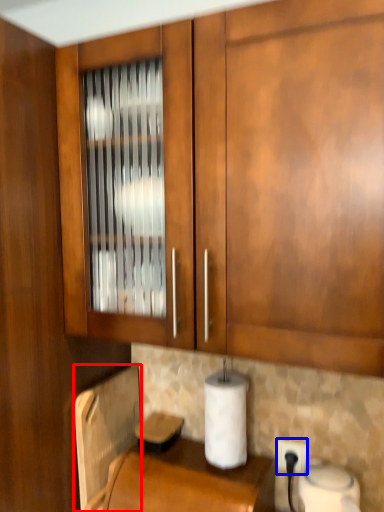
Question: Which of the following is the farthest to the observer, appliance (highlighted by a red box) or electric outlet (highlighted by a blue box)?

Choices:
 (A) appliance
 (B) electric outlet

Answer: (B)